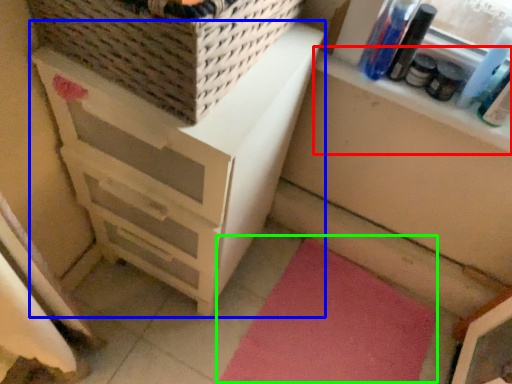
Question: Which is nearer to the window sill (highlighted by a red box)? chest of drawers (highlighted by a blue box) or yoga mat (highlighted by a green box).

Choices:
 (A) chest of drawers
 (B) yoga mat

Answer: (A)